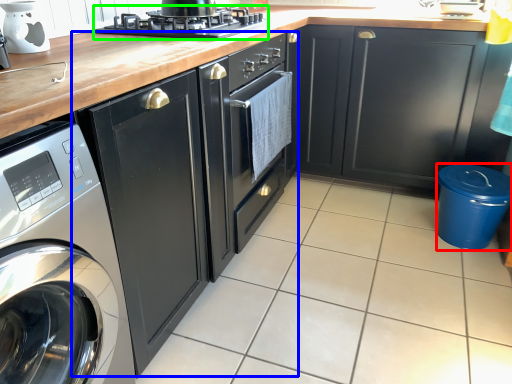
Question: Which is nearer to the appliance (highlighted by a red box)? cabinetry (highlighted by a blue box) or kitchen appliance (highlighted by a green box).

Choices:
 (A) cabinetry
 (B) kitchen appliance

Answer: (A)